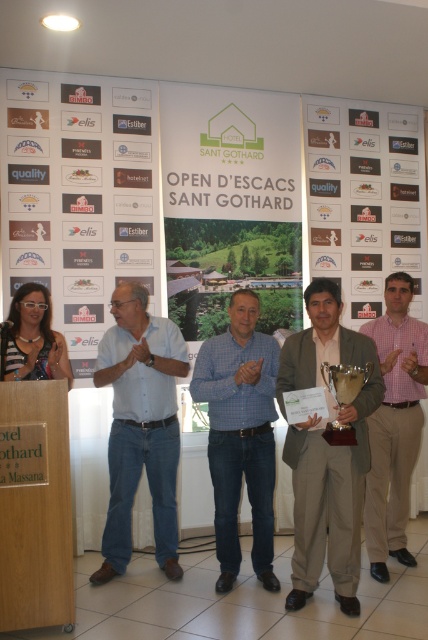
You are a photographer at the event and need to capture a photo of the matte brown suit at center without the white paper poster at left appearing in the background. Is this possible given their positions?

The white paper poster at left is above the matte brown suit at center, so if you position the camera below the poster and focus on the suit, it should be possible to exclude the poster from the frame.

You are a photographer at the event and need to ensure both the blue checkered shirt at center and the gold metallic trophy at center are clearly visible in your photo. Given their sizes, which object should you focus on to ensure it doesn

The blue checkered shirt at center has a larger size compared to the gold metallic trophy at center. Therefore, you should focus on the blue checkered shirt at center to ensure it is clearly visible, as its larger size makes it more prominent in the frame.